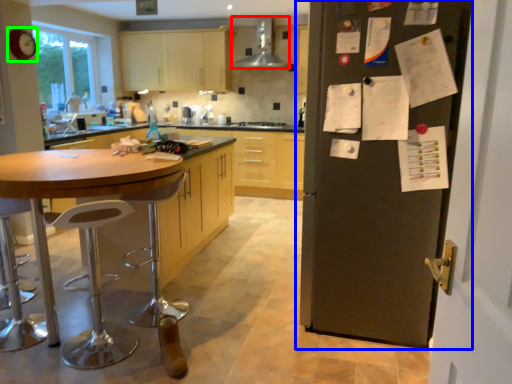
Question: Which object is positioned farthest from kitchen appliance (highlighted by a red box)? Select from door (highlighted by a blue box) and clock (highlighted by a green box).

Choices:
 (A) door
 (B) clock

Answer: (A)